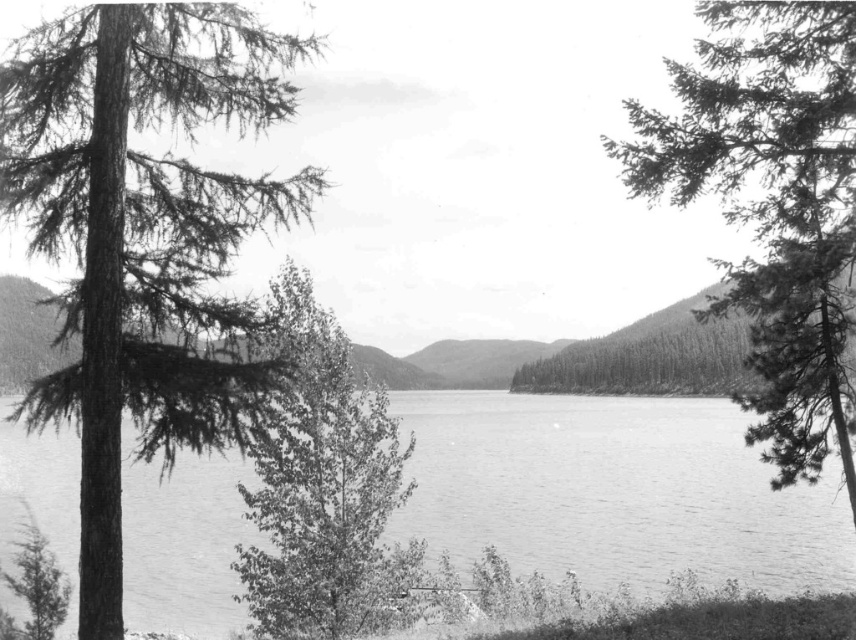
Which of these two, needle-like evergreen at right or smooth green tree at center, stands shorter?

smooth green tree at center is shorter.

Who is positioned more to the right, needle-like evergreen at right or smooth green tree at center?

needle-like evergreen at right is more to the right.

What do you see at coordinates (771, 204) in the screenshot?
I see `needle-like evergreen at right` at bounding box center [771, 204].

This screenshot has width=856, height=640. I want to click on needle-like evergreen at right, so (771, 204).

Is dark green textured tree trunk at left above smooth green tree at center?

Correct, dark green textured tree trunk at left is located above smooth green tree at center.

Which is in front, point (232, 93) or point (373, 586)?

Point (232, 93) is more forward.

Does point (159, 273) lie behind point (343, 566)?

That is False.

Locate an element on the screen. The image size is (856, 640). dark green textured tree trunk at left is located at coordinates (141, 234).

Can you confirm if smooth water at center is positioned above smooth green tree at center?

Incorrect, smooth water at center is not positioned above smooth green tree at center.

The width and height of the screenshot is (856, 640). I want to click on smooth water at center, so click(x=614, y=492).